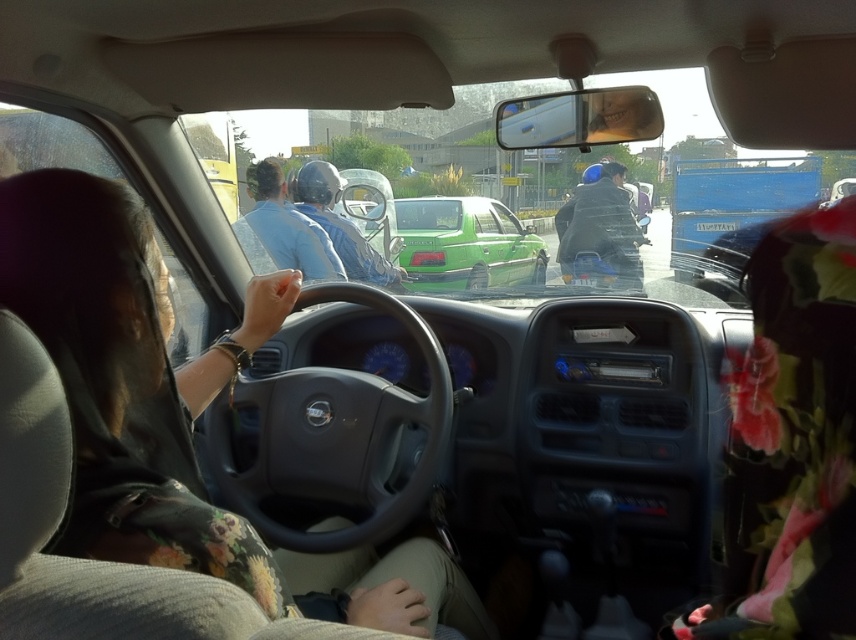
Question: Can you confirm if floral fabric dress at center is bigger than blue glossy helmet at center?

Choices:
 (A) no
 (B) yes

Answer: (A)

Question: Based on their relative distances, which object is farther from the dark blue helmet at center?

Choices:
 (A) blue glossy helmet at center
 (B) blue matte helmet at center

Answer: (B)

Question: Among these objects, which one is farthest from the camera?

Choices:
 (A) blue matte helmet at center
 (B) floral fabric dress at center

Answer: (A)

Question: Is the position of green matte car at center more distant than that of dark blue helmet at center?

Choices:
 (A) no
 (B) yes

Answer: (B)

Question: Which point is closer to the camera taking this photo?

Choices:
 (A) (342, 237)
 (B) (278, 166)

Answer: (B)

Question: Is floral fabric dress at center positioned behind blue matte helmet at center?

Choices:
 (A) no
 (B) yes

Answer: (A)